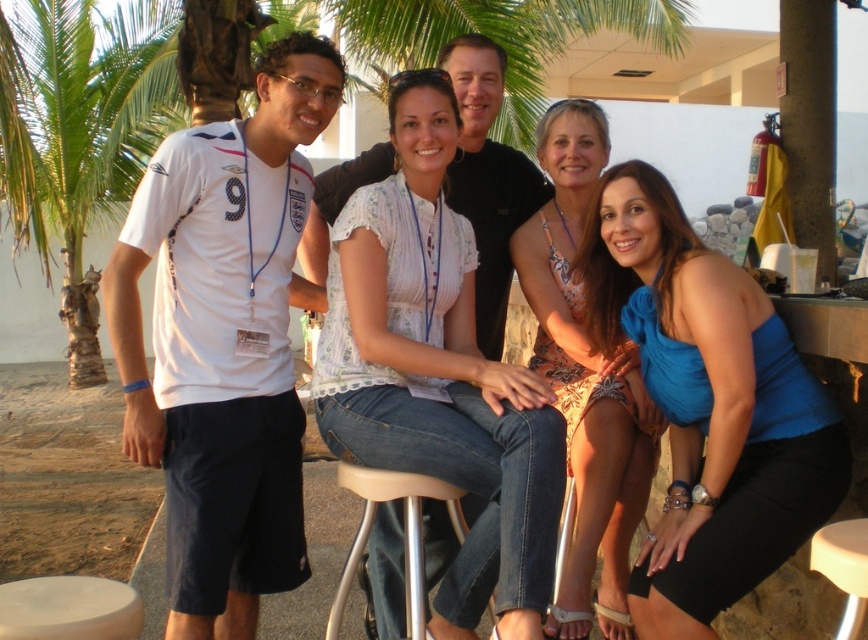
Measure the distance from white lace blouse at center to blue satin dress at lower right.

They are 61.72 centimeters apart.

Who is lower down, white lace blouse at center or blue satin dress at lower right?

blue satin dress at lower right is lower down.

I want to click on white lace blouse at center, so click(438, 372).

Locate an element on the screen. The height and width of the screenshot is (640, 868). white lace blouse at center is located at coordinates (438, 372).

Measure the distance from beige plastic stool at center to beige plastic bar stool at lower right.

beige plastic stool at center and beige plastic bar stool at lower right are 3.83 feet apart.

Where is `beige plastic stool at center`? beige plastic stool at center is located at coordinates (404, 532).

Where is `beige plastic stool at center`? beige plastic stool at center is located at coordinates (404, 532).

The height and width of the screenshot is (640, 868). Find the location of `beige plastic stool at center`. beige plastic stool at center is located at coordinates (404, 532).

Does white lace blouse at center come behind printed fabric dress at center?

No, white lace blouse at center is in front of printed fabric dress at center.

You are a GUI agent. You are given a task and a screenshot of the screen. Output one action in this format:
    pyautogui.click(x=<x>, y=<y>)
    Task: Click on the white lace blouse at center
    The height and width of the screenshot is (640, 868).
    Given the screenshot: What is the action you would take?
    pyautogui.click(x=438, y=372)

Is point (366, 353) positioned behind point (610, 493)?

No, (366, 353) is in front of (610, 493).

Where is `white lace blouse at center`? white lace blouse at center is located at coordinates (438, 372).